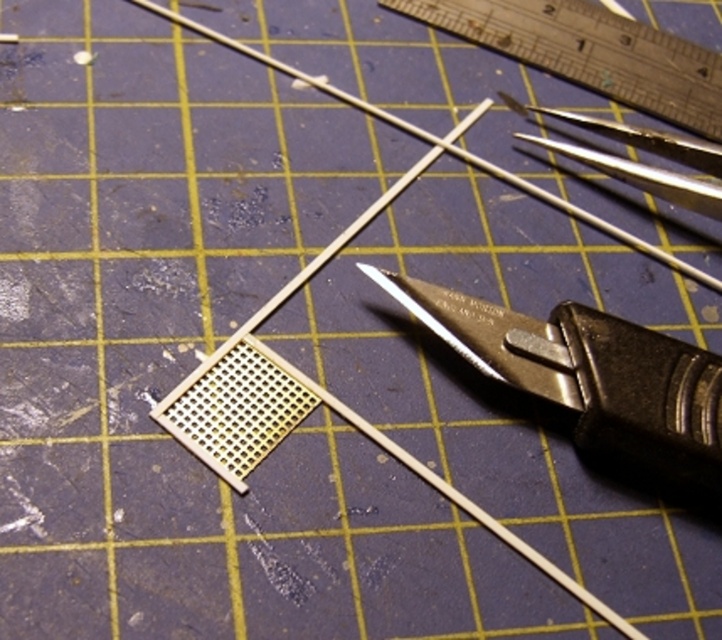
Question: Is metallic silver ruler at upper right below metallic silver scissors at upper right?

Choices:
 (A) yes
 (B) no

Answer: (B)

Question: Observing the image, what is the correct spatial positioning of black plastic utility knife at center in reference to metallic silver scissors at upper right?

Choices:
 (A) below
 (B) above

Answer: (A)

Question: Where is metallic silver ruler at upper right located in relation to metallic silver scissors at upper right in the image?

Choices:
 (A) above
 (B) below

Answer: (A)

Question: Which object is positioned closest to the metallic silver scissors at upper right?

Choices:
 (A) metallic silver ruler at upper right
 (B) black plastic utility knife at center

Answer: (A)

Question: Which point is closer to the camera?

Choices:
 (A) metallic silver scissors at upper right
 (B) black plastic utility knife at center
 (C) metallic silver ruler at upper right

Answer: (B)

Question: Considering the real-world distances, which object is closest to the metallic silver ruler at upper right?

Choices:
 (A) metallic silver scissors at upper right
 (B) black plastic utility knife at center

Answer: (A)